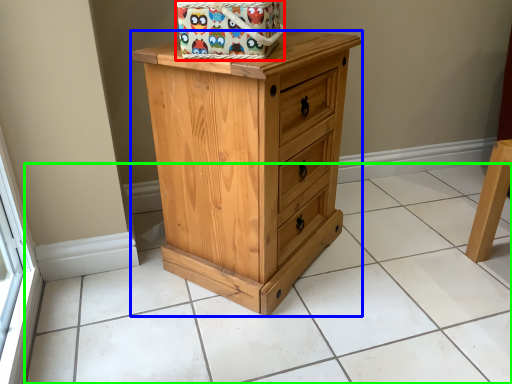
Question: Which object is positioned farthest from gift basket (highlighted by a red box)? Select from chest of drawers (highlighted by a blue box) and tile (highlighted by a green box).

Choices:
 (A) chest of drawers
 (B) tile

Answer: (B)